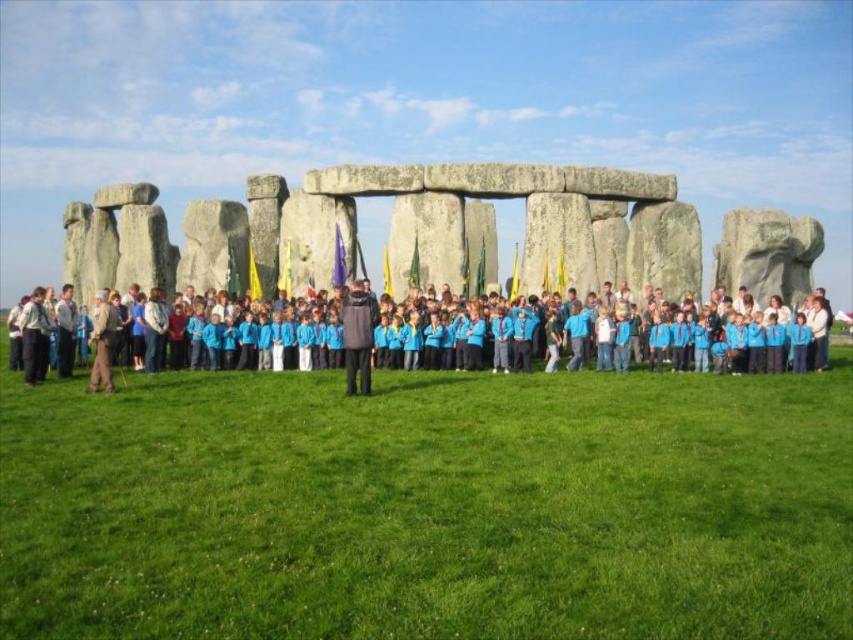
Question: Which object appears closest to the camera in this image?

Choices:
 (A) green grass at center
 (B) blue uniform at center
 (C) blue fabric flag at center
 (D) dark gray jacket at center

Answer: (A)

Question: Which object is closer to the camera taking this photo?

Choices:
 (A) blue fabric flag at center
 (B) dark gray jacket at center
 (C) blue uniform at center

Answer: (B)

Question: Is blue uniform at center thinner than blue fabric flag at center?

Choices:
 (A) no
 (B) yes

Answer: (A)

Question: Is green grass at center smaller than blue uniform at center?

Choices:
 (A) yes
 (B) no

Answer: (B)

Question: Which of the following is the farthest from the observer?

Choices:
 (A) (434, 340)
 (B) (358, 321)
 (C) (334, 225)
 (D) (370, 620)

Answer: (C)

Question: Is green grass at center smaller than blue uniform at center?

Choices:
 (A) yes
 (B) no

Answer: (B)